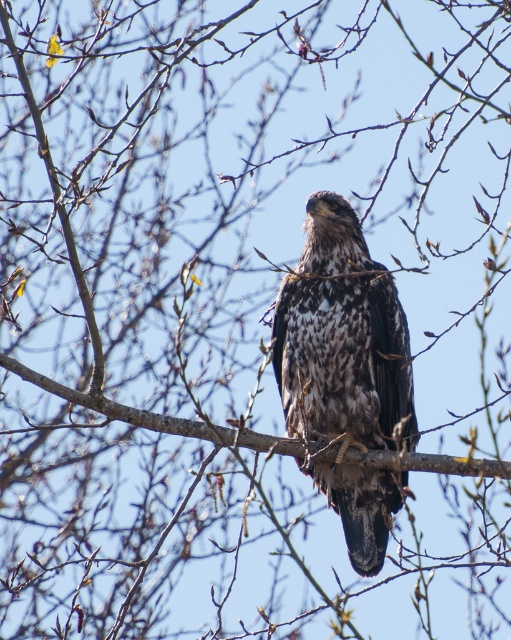
Question: Is speckled feathers falcon at center positioned before brown textured branch at center?

Choices:
 (A) no
 (B) yes

Answer: (A)

Question: Observing the image, what is the correct spatial positioning of speckled feathers falcon at center in reference to brown textured branch at center?

Choices:
 (A) right
 (B) left

Answer: (A)

Question: Which point is closer to the camera?

Choices:
 (A) (496, 468)
 (B) (353, 300)

Answer: (A)

Question: Does speckled feathers falcon at center lie behind brown textured branch at center?

Choices:
 (A) no
 (B) yes

Answer: (B)